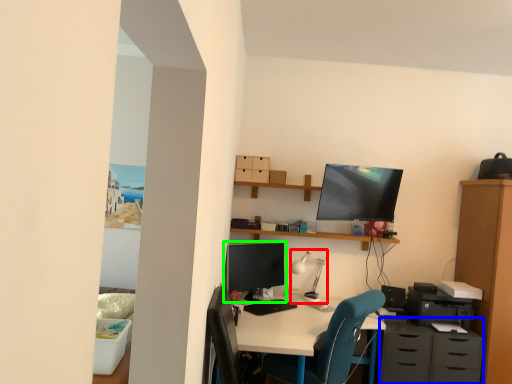
Question: Based on their relative distances, which object is nearer to lamp (highlighted by a red box)? Choose from dresser (highlighted by a blue box) and computer monitor (highlighted by a green box).

Choices:
 (A) dresser
 (B) computer monitor

Answer: (B)